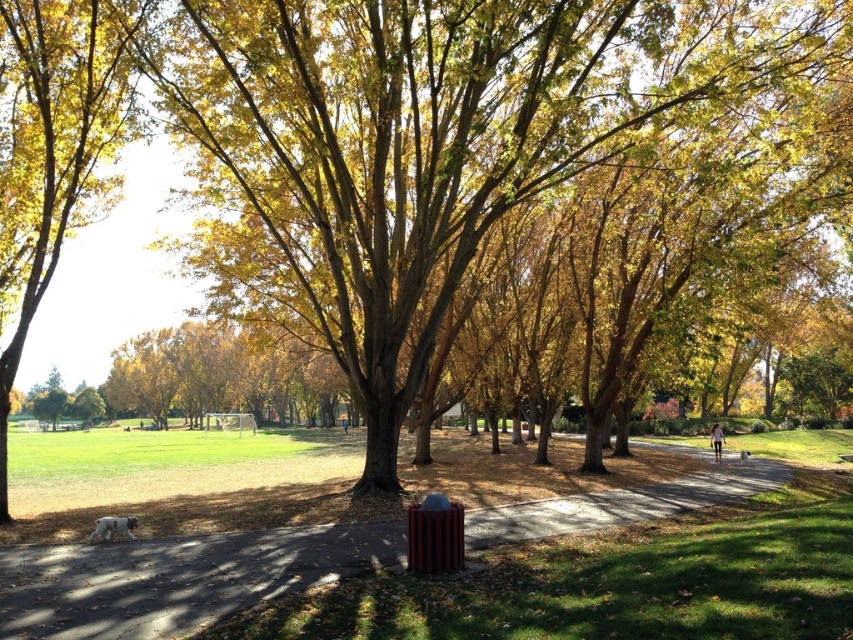
Question: Which of the following is the closest to the observer?

Choices:
 (A) metallic trash can at center
 (B) golden leafy tree at center

Answer: (A)

Question: Among these points, which one is nearest to the camera?

Choices:
 (A) (67, 92)
 (B) (70, 579)

Answer: (B)

Question: Is metallic trash can at center smaller than golden leafy tree at center?

Choices:
 (A) no
 (B) yes

Answer: (B)

Question: Can you confirm if metallic trash can at center is positioned above golden leafy tree at center?

Choices:
 (A) no
 (B) yes

Answer: (A)

Question: Can you confirm if metallic trash can at center is bigger than golden leafy tree at center?

Choices:
 (A) yes
 (B) no

Answer: (B)